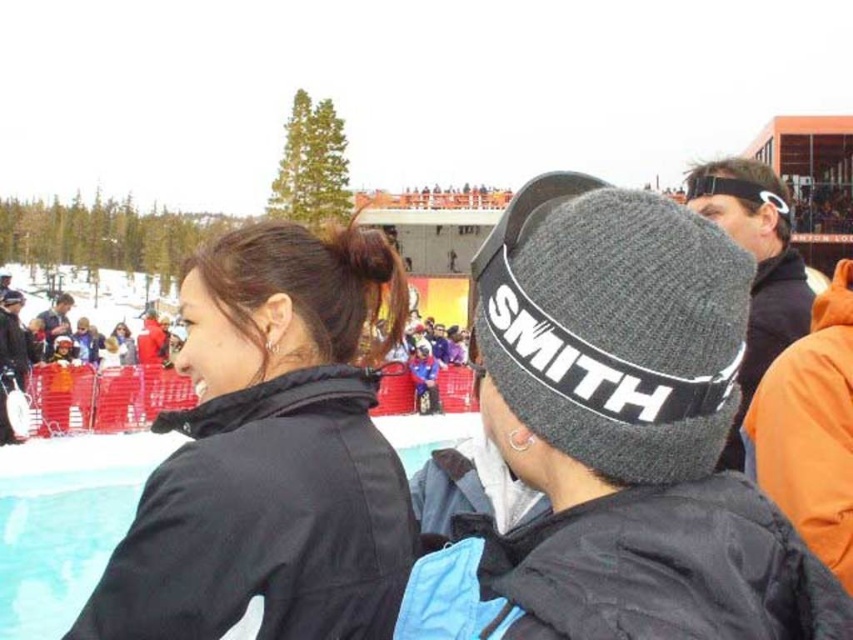
Does knit gray beanie at center have a lesser height compared to black matte jacket at left?

No, knit gray beanie at center is not shorter than black matte jacket at left.

Identify the location of knit gray beanie at center. coord(618,438).